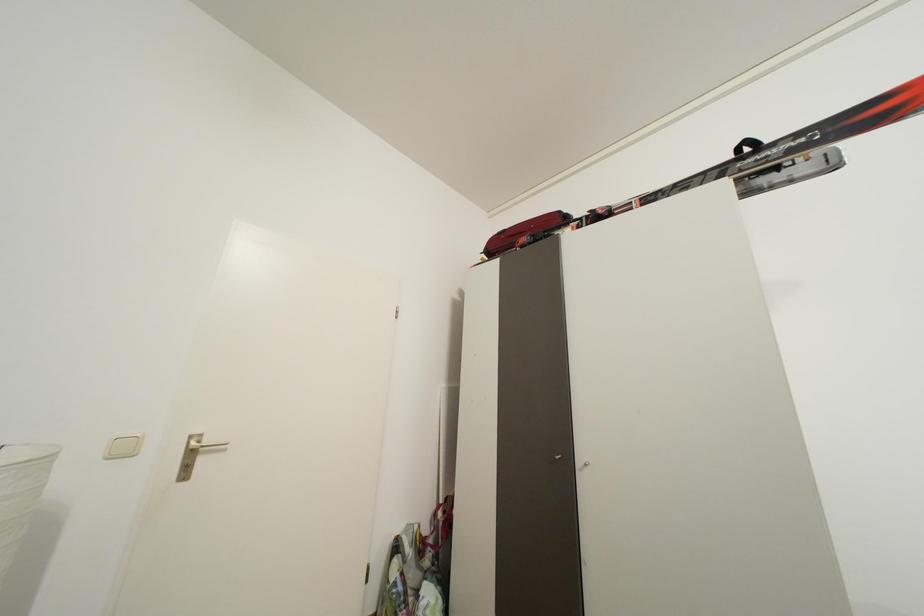
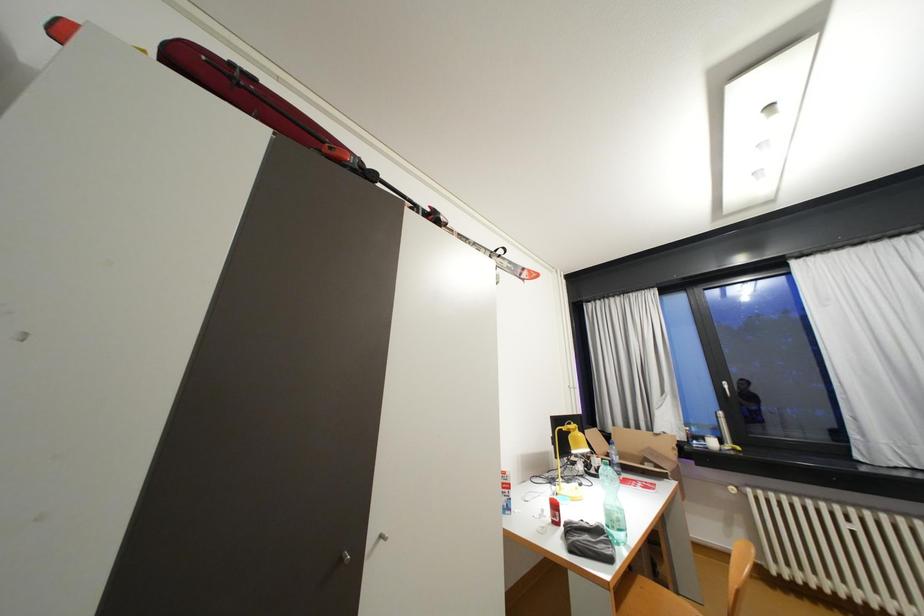
How did the camera likely rotate?

The camera's rotation is toward right-up.